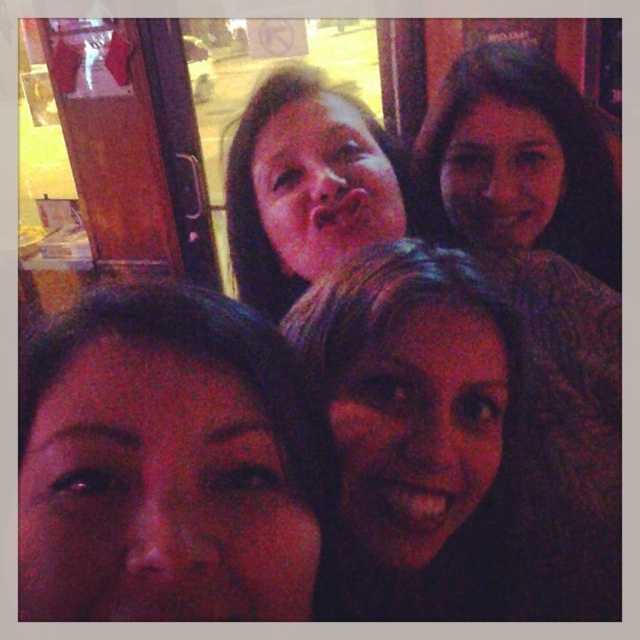
You are at a social gathering and want to take a selfie with two friends. You notice two points in the frame labeled as point [504,145] and point [456,177]. Which point is closer to the camera?

Point [504,145] is in front of point [456,177], so it is closer to the camera.

Based on the scene description, where is the dark hair at upper right located in terms of coordinates?

The dark hair at upper right is located at coordinates 0.448 on the x axis and 0.852 on the y axis.